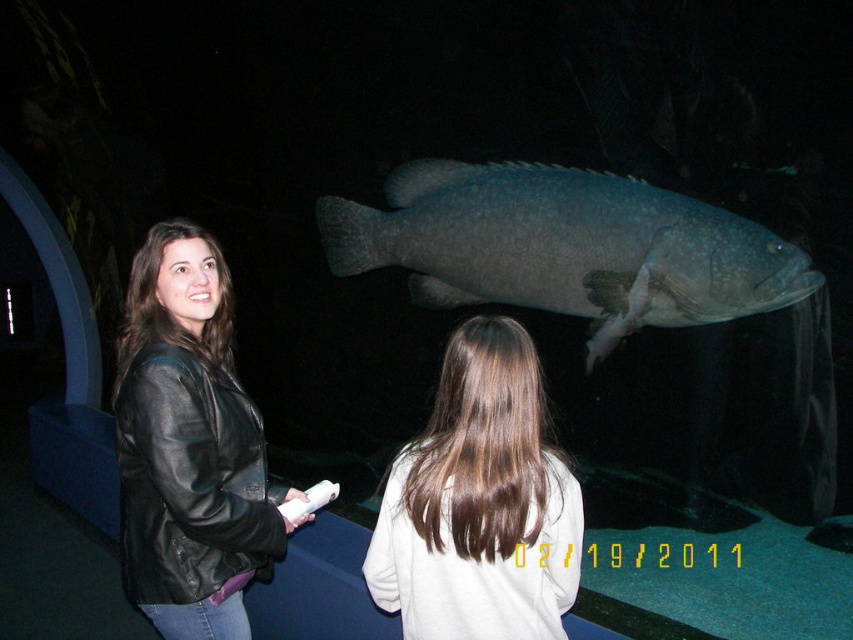
Who is higher up, gray textured fish at center or smooth brown hair at center?

gray textured fish at center

How much distance is there between gray textured fish at center and smooth brown hair at center?

gray textured fish at center is 1.36 meters from smooth brown hair at center.

Who is more forward, (508, 172) or (573, 589)?

Positioned in front is point (573, 589).

The height and width of the screenshot is (640, 853). Find the location of `gray textured fish at center`. gray textured fish at center is located at coordinates (566, 248).

Can you confirm if black leather jacket at left is wider than smooth brown hair at center?

Yes, black leather jacket at left is wider than smooth brown hair at center.

Can you confirm if black leather jacket at left is bigger than smooth brown hair at center?

Yes, black leather jacket at left is bigger than smooth brown hair at center.

Is point (144, 282) positioned before point (566, 465)?

That is False.

This screenshot has height=640, width=853. I want to click on black leather jacket at left, so click(189, 445).

Looking at this image, can you confirm if gray textured fish at center is bigger than black leather jacket at left?

Yes.

Does gray textured fish at center have a lesser width compared to black leather jacket at left?

No, gray textured fish at center is not thinner than black leather jacket at left.

What do you see at coordinates (566, 248) in the screenshot?
I see `gray textured fish at center` at bounding box center [566, 248].

Locate an element on the screen. The width and height of the screenshot is (853, 640). gray textured fish at center is located at coordinates (566, 248).